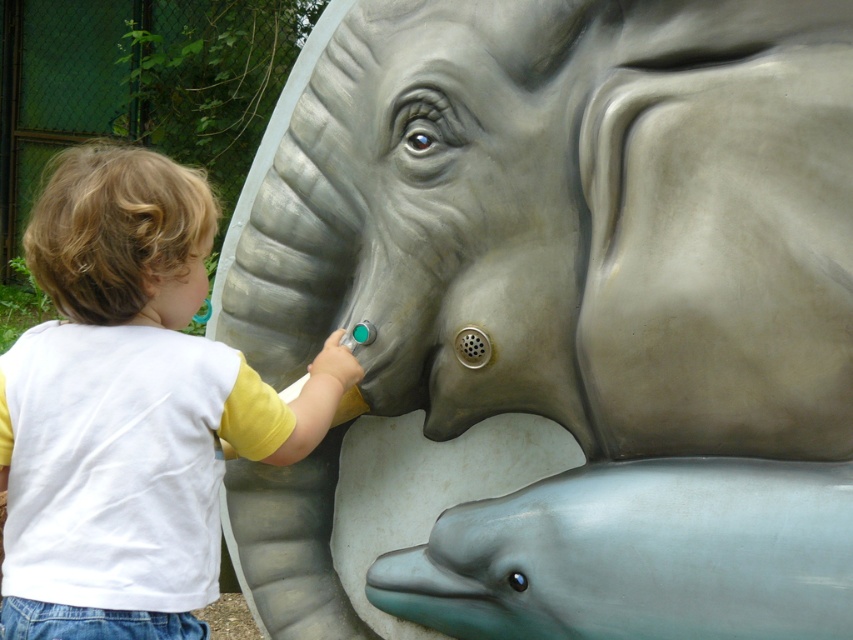
You are standing in front of the sculpture and want to press the button located at point (155, 524). If your arm can reach 5 feet, can you reach it without moving closer?

The point (155, 524) is 5.61 feet away from the viewer. Since your arm can only reach 5 feet, you cannot reach it without moving closer.